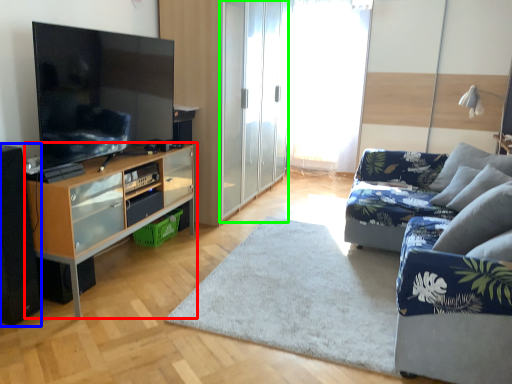
Question: Which object is positioned farthest from cabinetry (highlighted by a red box)? Select from speaker (highlighted by a blue box) and screen door (highlighted by a green box).

Choices:
 (A) speaker
 (B) screen door

Answer: (B)